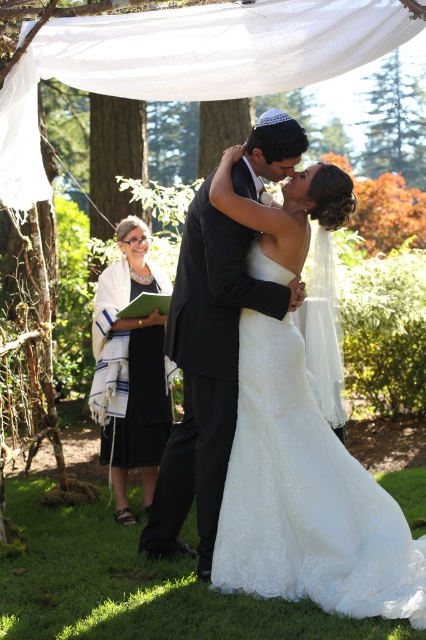
Is matte black suit at center positioned at the back of black wool shawl at left?

No, it is in front of black wool shawl at left.

Does matte black suit at center have a lesser height compared to black wool shawl at left?

No, matte black suit at center is not shorter than black wool shawl at left.

Which is in front, point (178, 305) or point (141, 264)?

Positioned in front is point (178, 305).

At what (x,y) coordinates should I click in order to perform the action: click on matte black suit at center. Please return your answer as a coordinate pair (x, y). Looking at the image, I should click on (206, 372).

Which is below, white lace dress at center or matte black suit at center?

white lace dress at center is lower down.

Can you confirm if white lace dress at center is wider than matte black suit at center?

Yes.

Between point (230, 188) and point (181, 326), which one is positioned in front?

Point (230, 188) is in front.

Image resolution: width=426 pixels, height=640 pixels. In order to click on white lace dress at center in this screenshot , I will do `click(305, 497)`.

Who is more distant from viewer, (239, 339) or (124, 440)?

The point (124, 440) is more distant.

Between point (417, 589) and point (143, 246), which one is positioned in front?

Point (417, 589) is in front.

Identify the location of white lace dress at center. (305, 497).